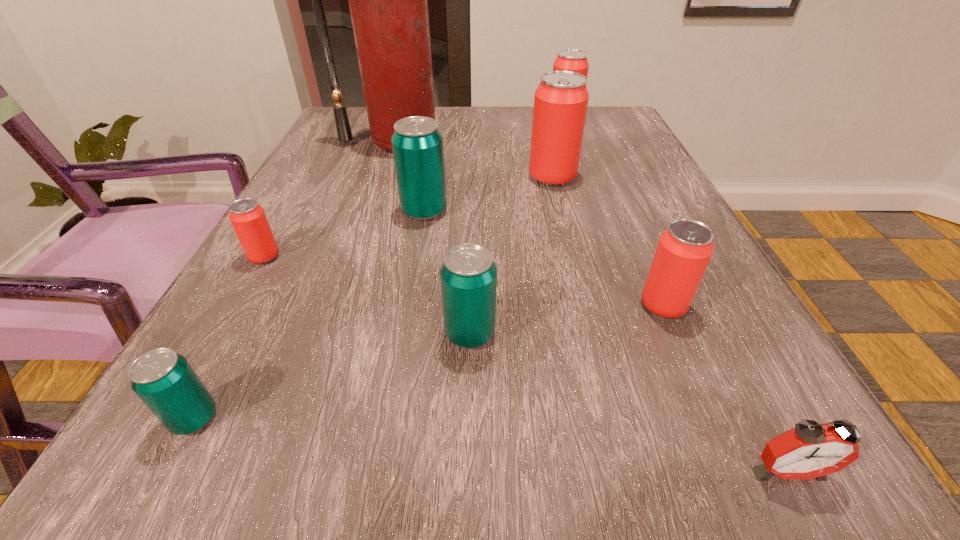
Locate an element on the screen. This screenshot has height=540, width=960. the rightmost teal beer can is located at coordinates pyautogui.click(x=468, y=274).

Locate an element on the screen. This screenshot has width=960, height=540. the smallest teal beer can is located at coordinates (164, 380).

Image resolution: width=960 pixels, height=540 pixels. What are the coordinates of `the nearest teal beer can` in the screenshot? It's located at (164, 380).

Locate an element on the screen. This screenshot has height=540, width=960. the fifth nearest object is located at coordinates (247, 217).

Identify the location of the fourth nearest beer can. (247, 217).

Where is `alarm clock`? alarm clock is located at coordinates (810, 450).

Where is `vacant area located 0.130m at the front of the red fire extinguisher where the nozzle is aimed`? This screenshot has height=540, width=960. vacant area located 0.130m at the front of the red fire extinguisher where the nozzle is aimed is located at coordinates (379, 190).

You are a GUI agent. You are given a task and a screenshot of the screen. Output one action in this format:
    pyautogui.click(x=<x>, y=<y>)
    Task: Click on the vacant space situated 0.140m on the left of the biggest red beer can
    
    Given the screenshot: What is the action you would take?
    pyautogui.click(x=461, y=177)

Where is `vacant space located on the front of the third smallest red beer can`? vacant space located on the front of the third smallest red beer can is located at coordinates click(x=588, y=193).

At what (x,y) coordinates should I click in order to perform the action: click on free space located on the back of the second teal beer can from right to left. Please return your answer as a coordinate pair (x, y). This screenshot has height=540, width=960. Looking at the image, I should click on (434, 151).